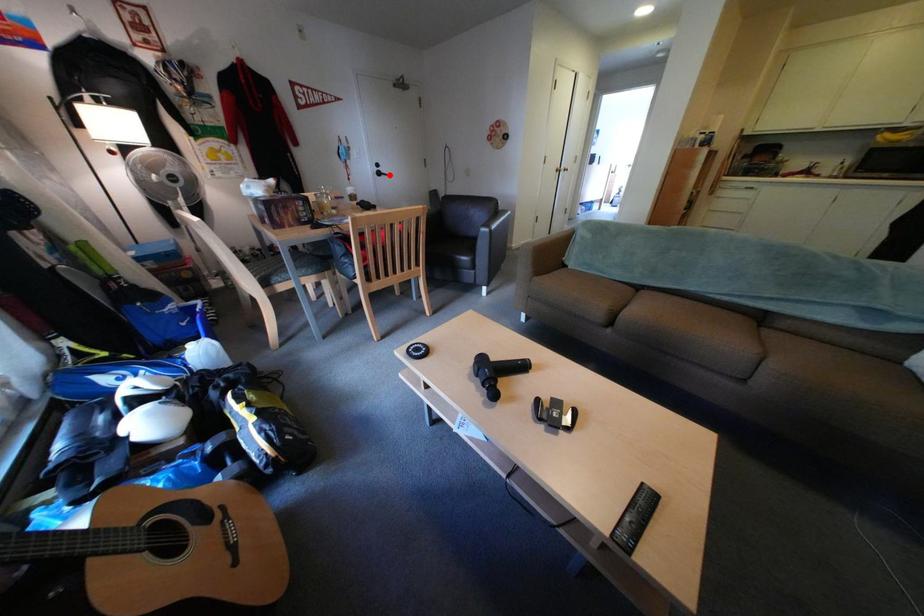
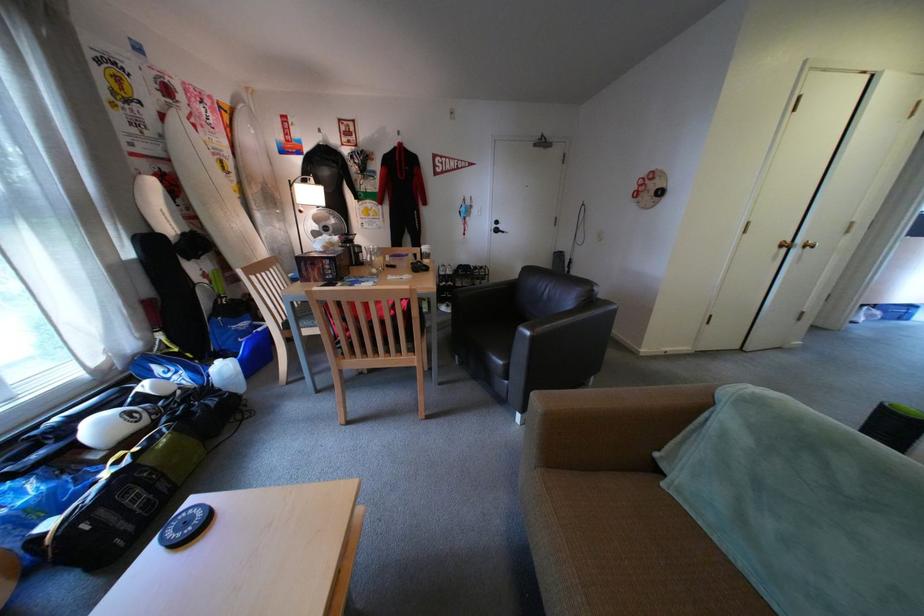
Question: A red point is marked in image1. In image2, is the corresponding 3D point closer to the camera or farther? Reply with the corresponding letter.

Choices:
 (A) The corresponding 3D point is closer.
 (B) The corresponding 3D point is farther.

Answer: (B)